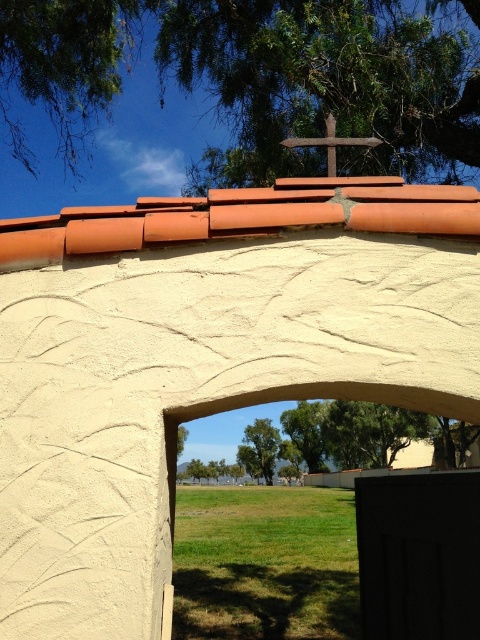
You are standing in front of the stone archway and want to determine which of the two green leafy trees is taller. The trees in question are the green leafy tree at upper center and the green leafy tree at center. Based on their positions, which one is taller?

The green leafy tree at center is taller than the green leafy tree at upper center according to the description.

You are standing in front of the stone archway and notice two green leafy trees in the distance. Which tree, the green leafy tree at upper center or the green leafy tree at center, is positioned to the right of the other?

The green leafy tree at upper center is positioned to the right of the green leafy tree at center.

You are an architect designing a garden pathway that needs to pass between the smooth stucco arch at upper center and the green leafy tree at upper center. Based on the scene, which direction should the pathway be directed to ensure it stays within the visible grassy field?

The smooth stucco arch at upper center is positioned under the green leafy tree at upper center, so the pathway should be directed towards the open grassy field visible through the arch to stay within the visible grassy field.